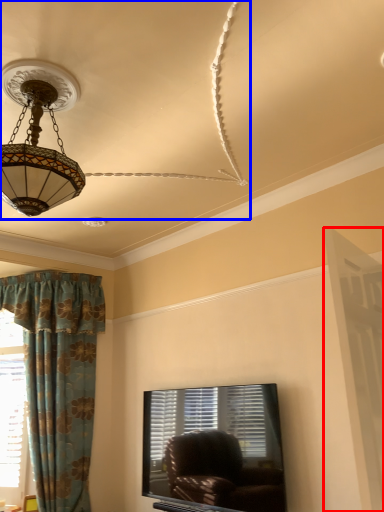
Question: Among these objects, which one is farthest to the camera, screen door (highlighted by a red box) or fan (highlighted by a blue box)?

Choices:
 (A) screen door
 (B) fan

Answer: (A)